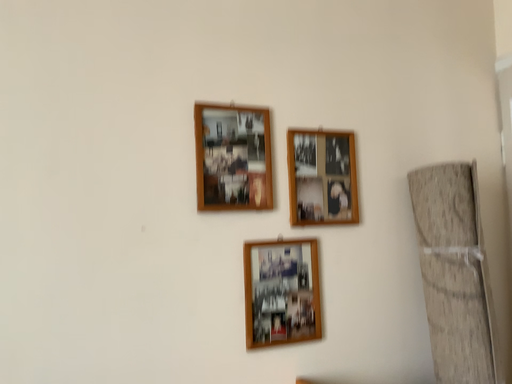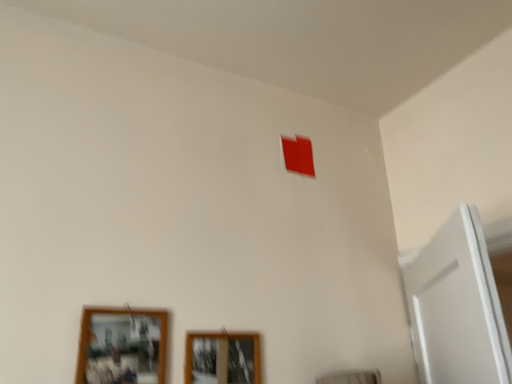
Question: How did the camera likely rotate when shooting the video?

Choices:
 (A) rotated right
 (B) rotated left

Answer: (A)